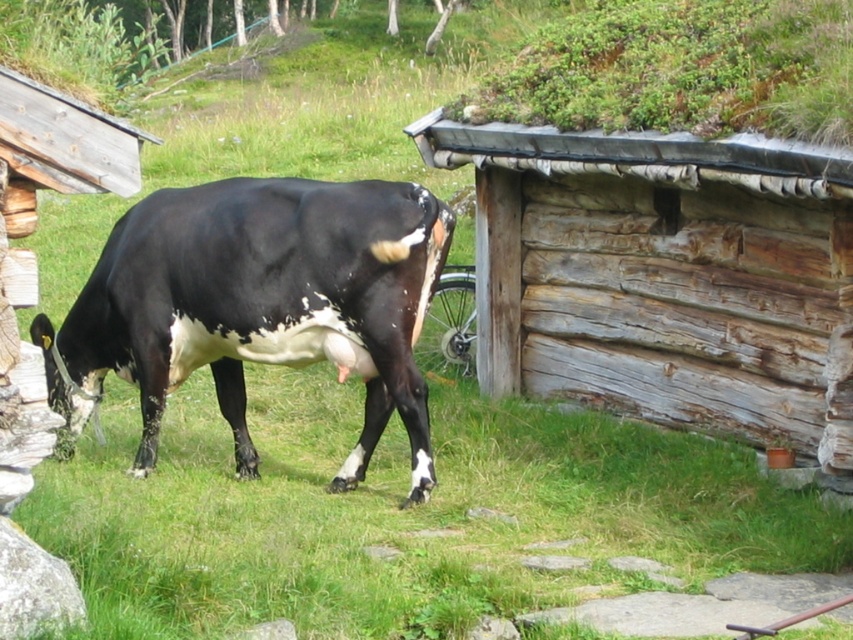
Between weathered wood log cabin at center-right and black glossy cow at center, which one is positioned lower?

black glossy cow at center is below.

Who is more distant from viewer, [436,112] or [129,372]?

Point [436,112]

Find the location of a particular element. weathered wood log cabin at center-right is located at coordinates (666, 278).